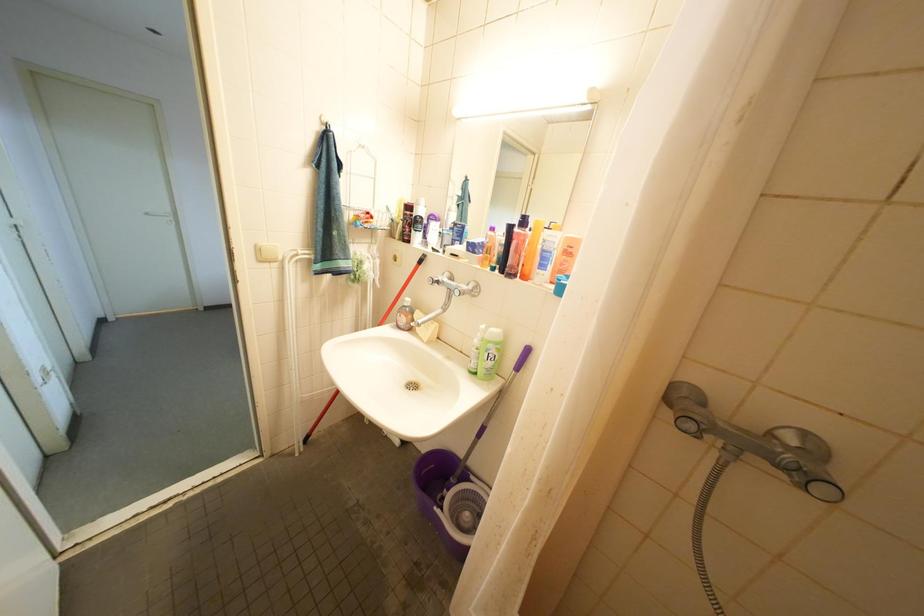
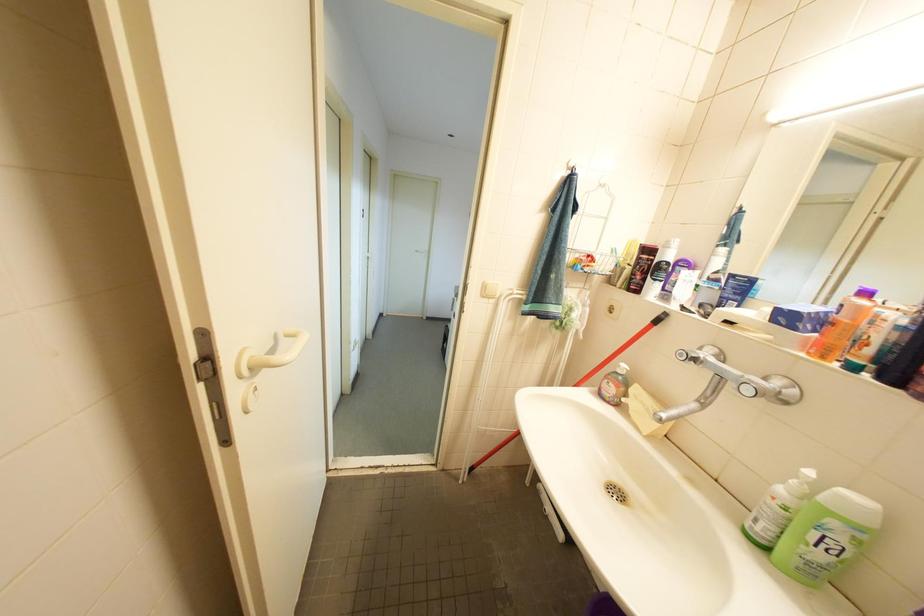
Question: The images are taken continuously from a first-person perspective. In which direction is your viewpoint rotating?

Choices:
 (A) Left
 (B) Right
 (C) Up
 (D) Down

Answer: (A)